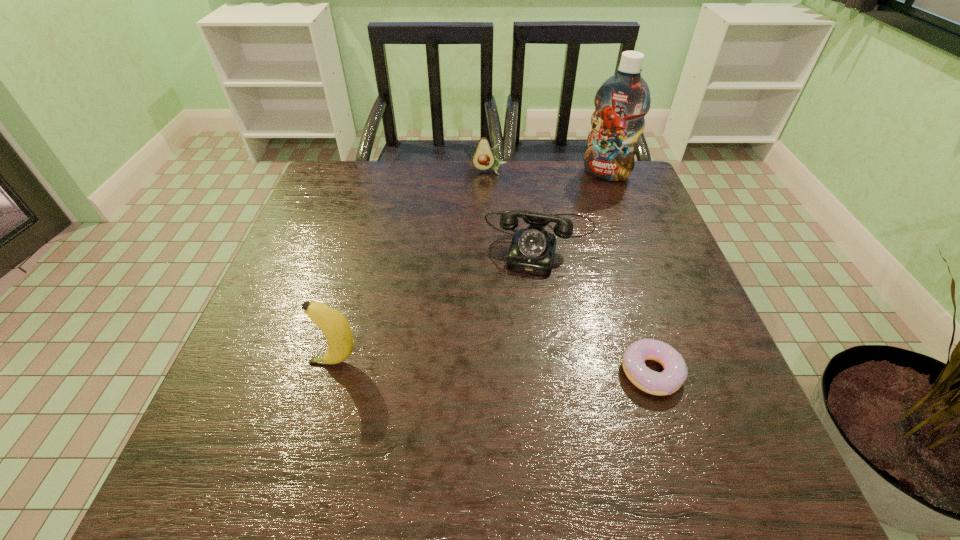
What are the coordinates of `vacant area situated 0.080m on the front-facing side of the third nearest object` in the screenshot? It's located at (527, 301).

The width and height of the screenshot is (960, 540). Find the location of `vacant area situated on the front-facing side of the third nearest object`. vacant area situated on the front-facing side of the third nearest object is located at coordinates (505, 408).

Locate an element on the screen. vacant space located 0.380m on the front label of the shampoo is located at coordinates point(558,262).

Locate an element on the screen. The height and width of the screenshot is (540, 960). free space located 0.290m on the front label of the shampoo is located at coordinates (569, 240).

Where is `free space located on the front label of the shampoo`? The image size is (960, 540). free space located on the front label of the shampoo is located at coordinates (569, 240).

You are a GUI agent. You are given a task and a screenshot of the screen. Output one action in this format:
    pyautogui.click(x=<x>, y=<y>)
    Task: Click on the vacant region located on the seed side of the avocado
    
    Given the screenshot: What is the action you would take?
    pyautogui.click(x=499, y=231)

You are a GUI agent. You are given a task and a screenshot of the screen. Output one action in this format:
    pyautogui.click(x=<x>, y=<y>)
    Task: Click on the vacant area situated 0.170m on the seed side of the avocado
    The height and width of the screenshot is (540, 960).
    Given the screenshot: What is the action you would take?
    pyautogui.click(x=496, y=210)

You are a GUI agent. You are given a task and a screenshot of the screen. Output one action in this format:
    pyautogui.click(x=<x>, y=<y>)
    Task: Click on the vacant space positioned on the seed side of the avocado
    This screenshot has height=540, width=960.
    Given the screenshot: What is the action you would take?
    pyautogui.click(x=497, y=219)

The width and height of the screenshot is (960, 540). In order to click on shampoo that is at the far edge in this screenshot , I will do `click(622, 101)`.

You are a GUI agent. You are given a task and a screenshot of the screen. Output one action in this format:
    pyautogui.click(x=<x>, y=<y>)
    Task: Click on the avocado that is positioned at the far edge
    The height and width of the screenshot is (540, 960).
    Given the screenshot: What is the action you would take?
    pyautogui.click(x=484, y=158)